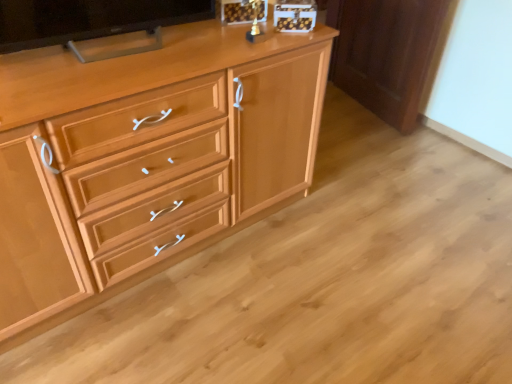
This screenshot has width=512, height=384. I want to click on vacant space to the left of light brown wood cabinet at right, so click(344, 109).